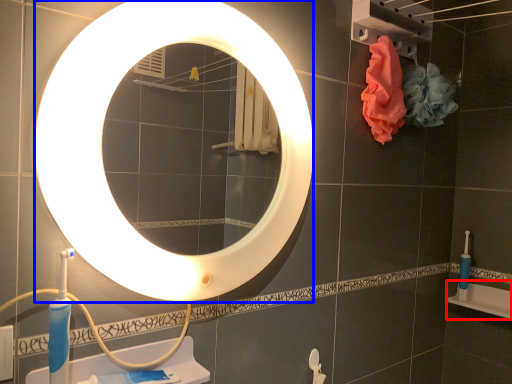
Question: Which of the following is the closest to the observer, bath (highlighted by a red box) or mirror (highlighted by a blue box)?

Choices:
 (A) bath
 (B) mirror

Answer: (B)